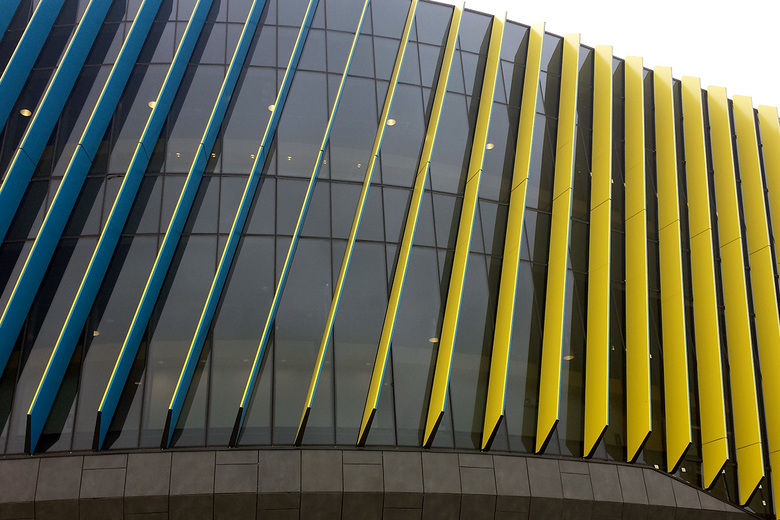
Locate an element on the screen. window is located at coordinates (300, 129).